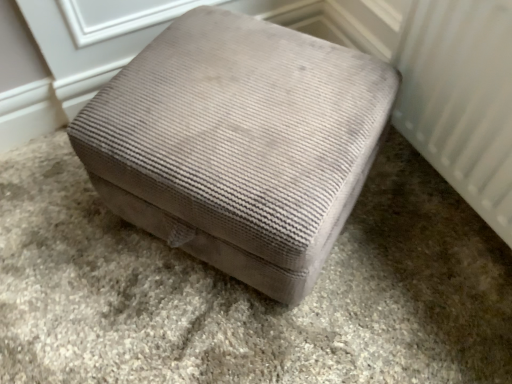
Question: Is velvet ottoman at center shorter than velvet ottoman at center?

Choices:
 (A) no
 (B) yes

Answer: (A)

Question: Is velvet ottoman at center inside velvet ottoman at center?

Choices:
 (A) yes
 (B) no

Answer: (B)

Question: From the image's perspective, would you say velvet ottoman at center is shown under velvet ottoman at center?

Choices:
 (A) yes
 (B) no

Answer: (B)

Question: Is velvet ottoman at center facing away from velvet ottoman at center?

Choices:
 (A) no
 (B) yes

Answer: (A)

Question: Does velvet ottoman at center turn towards velvet ottoman at center?

Choices:
 (A) no
 (B) yes

Answer: (A)

Question: From a real-world perspective, relative to white textured radiator at right, is velvet ottoman at center vertically above or below?

Choices:
 (A) above
 (B) below

Answer: (B)

Question: Choose the correct answer: Is velvet ottoman at center inside white textured radiator at right or outside it?

Choices:
 (A) outside
 (B) inside

Answer: (A)

Question: In terms of size, does velvet ottoman at center appear bigger or smaller than white textured radiator at right?

Choices:
 (A) big
 (B) small

Answer: (A)

Question: Is velvet ottoman at center in front of or behind white textured radiator at right in the image?

Choices:
 (A) front
 (B) behind

Answer: (B)

Question: From the image's perspective, is beige textured ottoman at center positioned above or below white textured radiator at right?

Choices:
 (A) above
 (B) below

Answer: (A)

Question: Considering the positions of beige textured ottoman at center and white textured radiator at right in the image, is beige textured ottoman at center taller or shorter than white textured radiator at right?

Choices:
 (A) short
 (B) tall

Answer: (A)

Question: Considering the positions of beige textured ottoman at center and white textured radiator at right in the image, is beige textured ottoman at center bigger or smaller than white textured radiator at right?

Choices:
 (A) small
 (B) big

Answer: (A)

Question: From a real-world perspective, relative to white textured radiator at right, is beige textured ottoman at center vertically above or below?

Choices:
 (A) above
 (B) below

Answer: (B)

Question: Considering the positions of point (437, 135) and point (27, 241), is point (437, 135) closer or farther from the camera than point (27, 241)?

Choices:
 (A) farther
 (B) closer

Answer: (B)

Question: Based on their positions, is white textured radiator at right located to the left or right of velvet ottoman at center?

Choices:
 (A) right
 (B) left

Answer: (A)